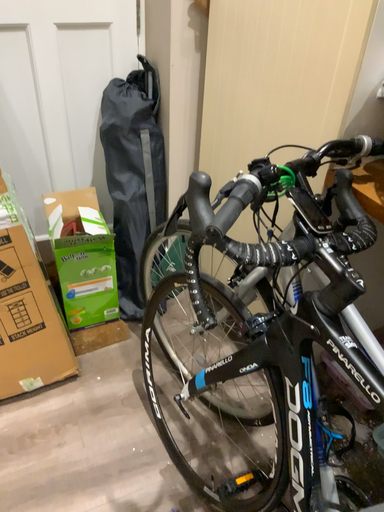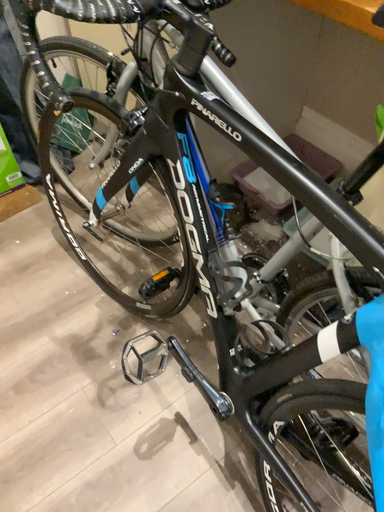
Question: How did the camera likely rotate when shooting the video?

Choices:
 (A) rotated left
 (B) rotated right

Answer: (B)